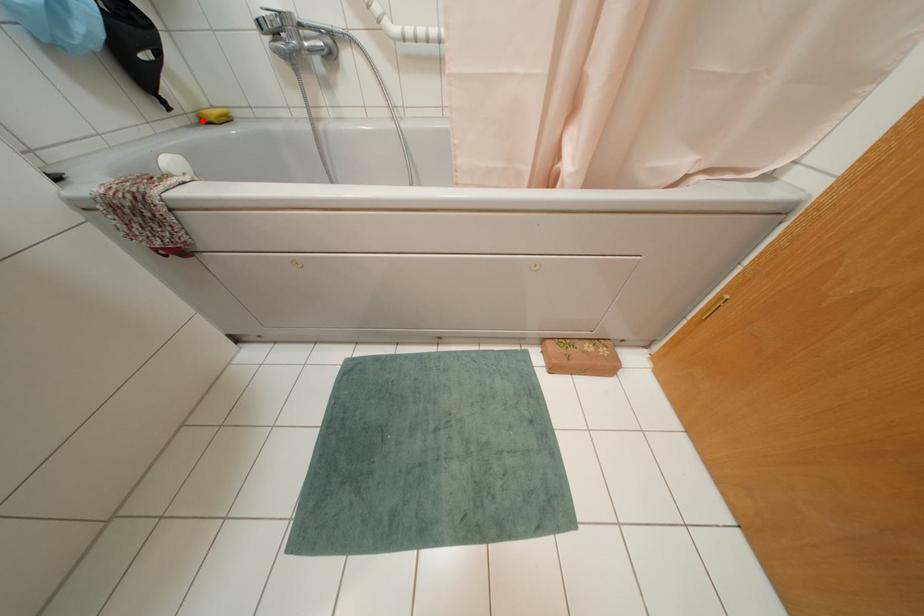
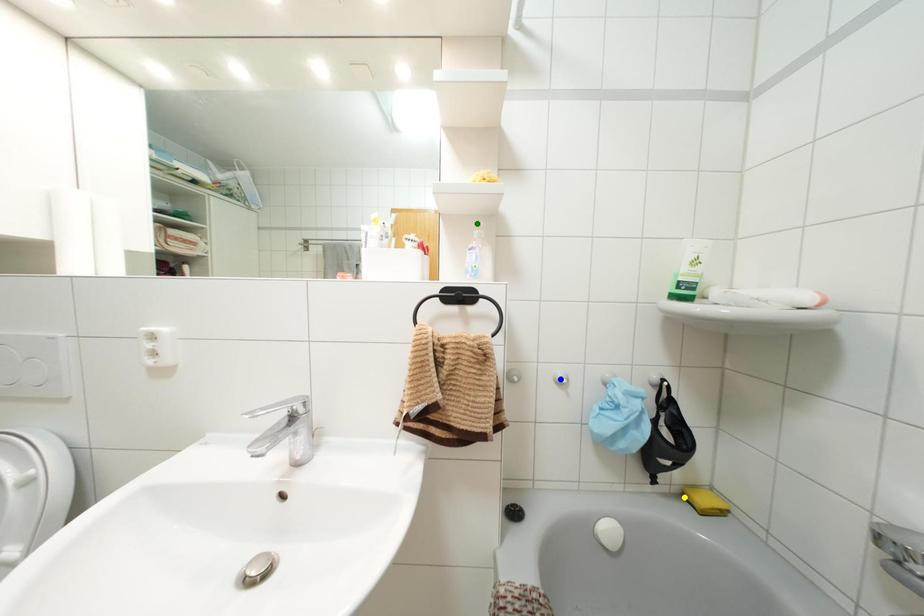
Question: I am providing you with two images of the same scene from different viewpoints. A red point is marked on the first image. You are given multiple points on the second image. Which point in image 2 represents the same 3d spot as the red point in image 1?

Choices:
 (A) green point
 (B) blue point
 (C) yellow point

Answer: (C)